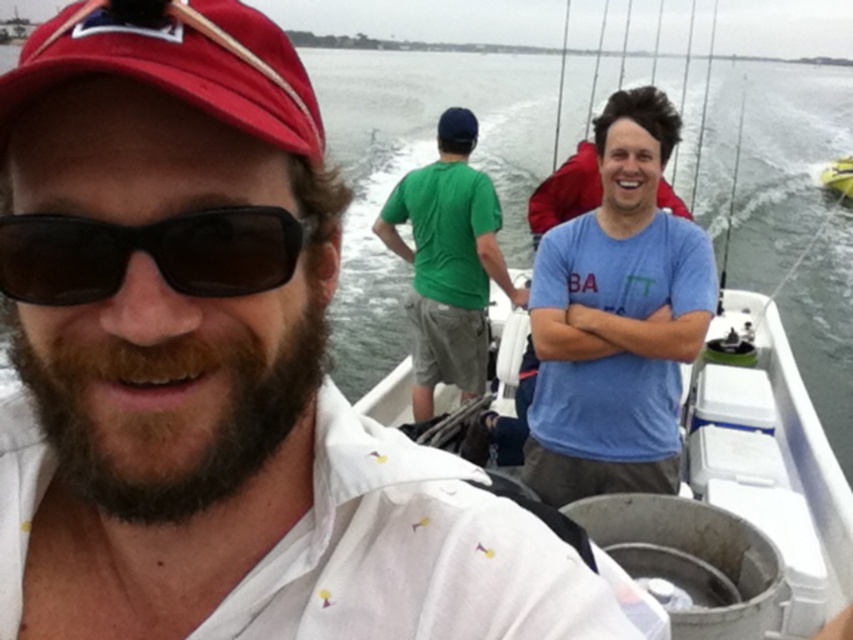
You are planning to place a decorative item on the deck of the white plastic boat at center. The item is as wide as the black plastic sunglasses at left. Will it fit without overhanging the deck?

The white plastic boat at center is wider than the black plastic sunglasses at left. Since the item is as wide as the sunglasses, it will fit on the deck without overhanging.

You are planning to place a 1.5 meter wide cooler on the white plastic boat at center. The green cotton shirt at center is currently occupying space on the boat. Can the cooler fit on the boat if the shirt is moved?

The white plastic boat at center might be wider than green cotton shirt at center, so it is possible that the cooler can fit if the shirt is moved, but the exact width of the boat isn

In the scene shown: You are on a boat and want to take a photo of the black plastic sunglasses at left. Since the white plastic boat at center is blocking your view, can you move around the boat to get a clear shot?

The black plastic sunglasses at left is behind the white plastic boat at center, so moving around the boat might allow you to see the sunglasses if they are positioned in a way that they become visible from the other side of the boat.